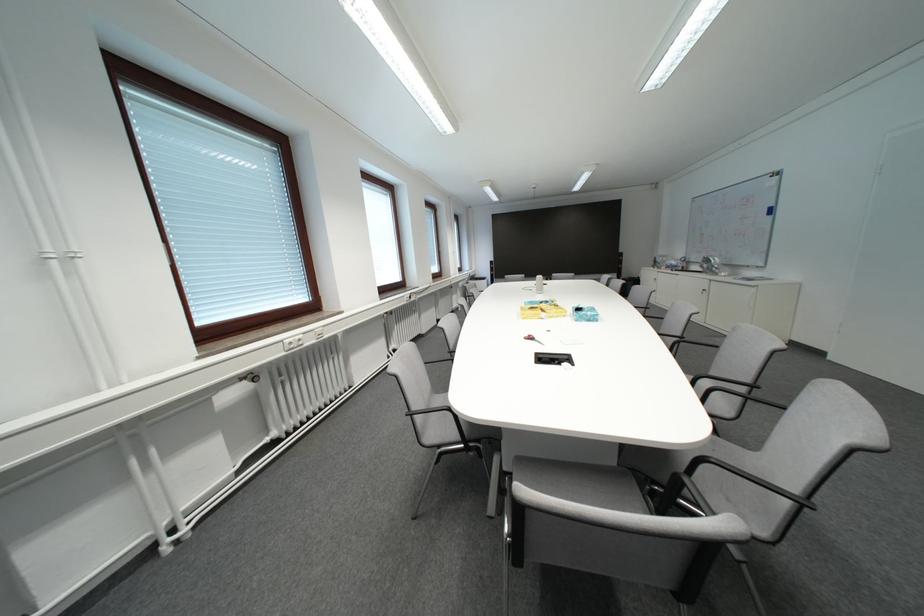
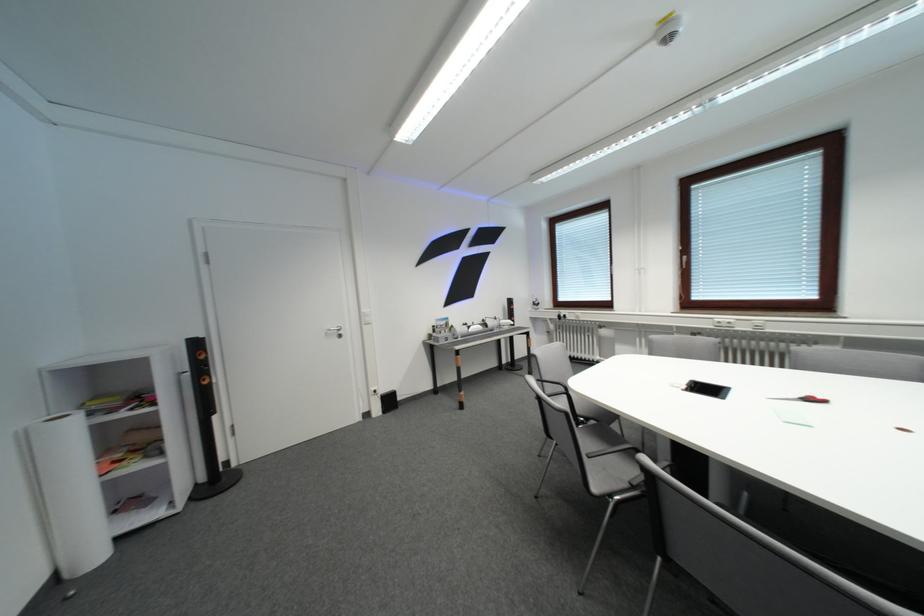
Find the pixel in the second image that matches pixel 575 367 in the first image.

(695, 389)